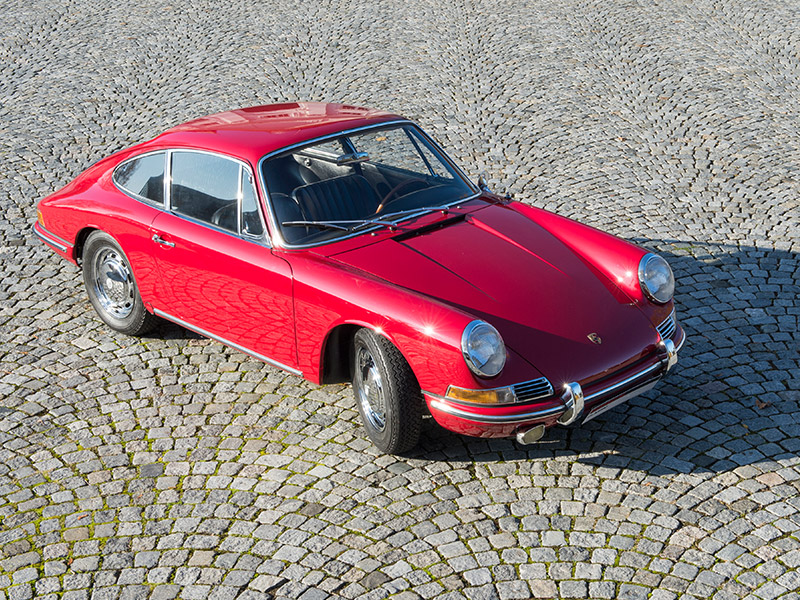
Where is `hood`? The width and height of the screenshot is (800, 600). hood is located at coordinates (581, 297).